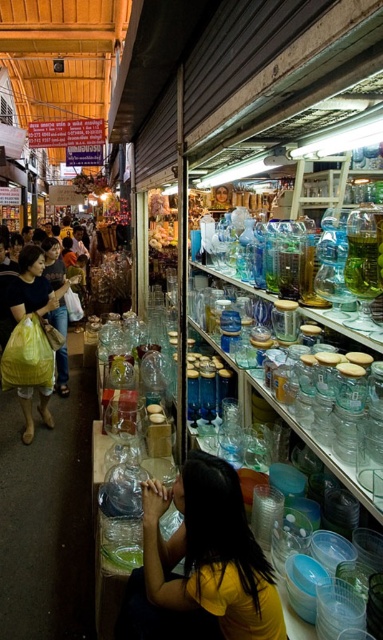
Can you confirm if yellow matte shirt at center is positioned below yellow plastic bag at left?

Yes, yellow matte shirt at center is below yellow plastic bag at left.

Which is behind, point (256, 634) or point (24, 374)?

Positioned behind is point (24, 374).

Between point (155, 548) and point (14, 314), which one is positioned in front?

Point (155, 548) is in front.

Identify the location of yellow matte shirt at center. [206, 556].